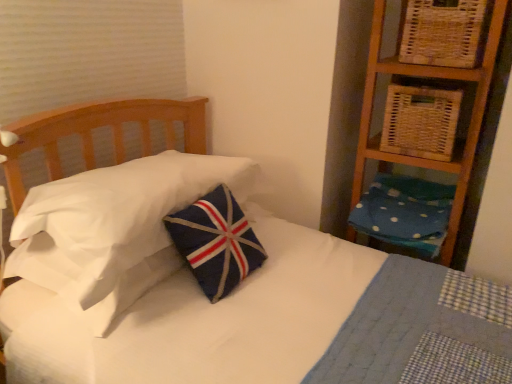
Question: Considering the positions of navy felt pillow at center, which is the second pillow from right to left, and blue dotted fabric pillow at right, the first pillow viewed from the right, in the image, is navy felt pillow at center, which is the second pillow from right to left, wider or thinner than blue dotted fabric pillow at right, the first pillow viewed from the right,?

Choices:
 (A) thin
 (B) wide

Answer: (A)

Question: In terms of height, does navy felt pillow at center, which is the second pillow from right to left, look taller or shorter compared to blue dotted fabric pillow at right, the first pillow viewed from the right?

Choices:
 (A) short
 (B) tall

Answer: (B)

Question: Estimate the real-world distances between objects in this image. Which object is farther from the blue dotted fabric pillow at right, the first pillow viewed from the right?

Choices:
 (A) woven wicker basket at upper right, marked as the second basket in a bottom-to-top arrangement
 (B) navy felt pillow at center, the first pillow in the left-to-right sequence
 (C) woven natural basket at upper right, the second basket viewed from the top

Answer: (B)

Question: Which object is positioned closest to the navy felt pillow at center, which is the second pillow from right to left?

Choices:
 (A) woven wicker basket at upper right, marked as the second basket in a bottom-to-top arrangement
 (B) woven natural basket at upper right, the second basket viewed from the top
 (C) blue dotted fabric pillow at right, the first pillow viewed from the right

Answer: (C)